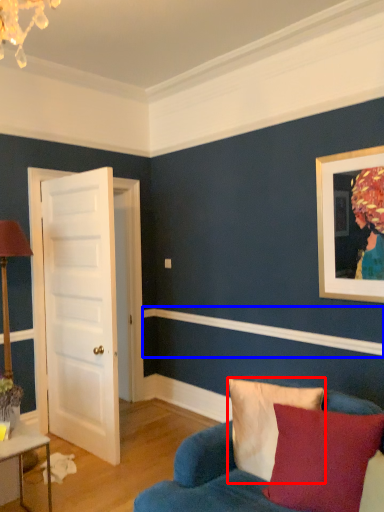
Question: Which object is further to the camera taking this photo, pillow (highlighted by a red box) or molding (highlighted by a blue box)?

Choices:
 (A) pillow
 (B) molding

Answer: (B)